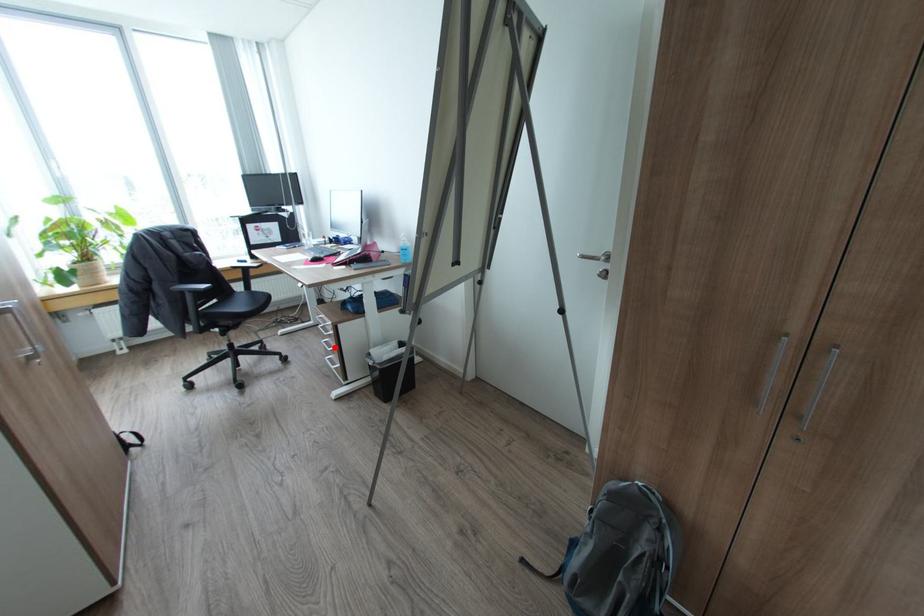
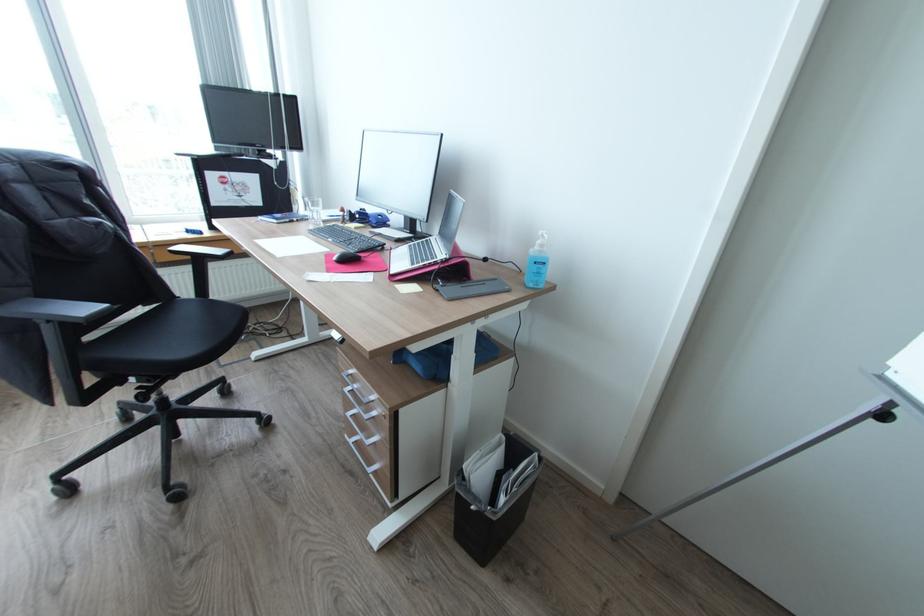
Question: I am providing you with two images of the same scene from different viewpoints. A red point is marked on the first image. At the location where the point appears in image 1, is it still visible in image 2?

Choices:
 (A) Yes
 (B) No

Answer: (A)